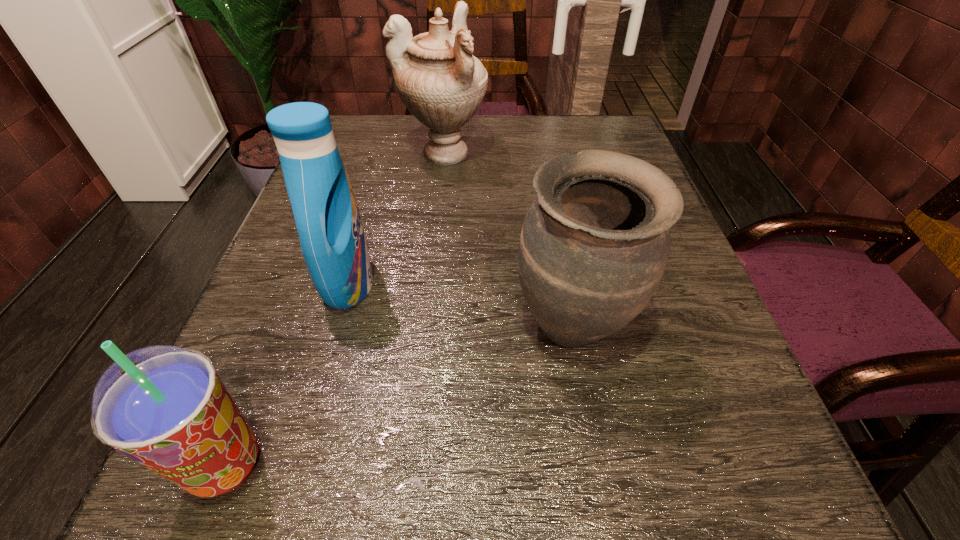
I want to click on unoccupied area between the farthest object and the shorter urn, so (508, 240).

Locate an element on the screen. free space between the nearest object and the detergent is located at coordinates [x=287, y=374].

Find the location of a particular element. vacant region between the nearest object and the shorter urn is located at coordinates click(x=399, y=396).

Identify the location of object that stands as the closest to the rightmost object. Image resolution: width=960 pixels, height=540 pixels. (333, 243).

Select which object is the second closest to the rightmost object. Please provide its 2D coordinates. Your answer should be formatted as a tuple, i.e. [(x, y)], where the tuple contains the x and y coordinates of a point satisfying the conditions above.

[(165, 407)]

You are a GUI agent. You are given a task and a screenshot of the screen. Output one action in this format:
    pyautogui.click(x=<x>, y=<y>)
    Task: Click on the vacant space that satisfies the following two spatial constraints: 1. on the front-facing side of the detergent; 2. on the back side of the rightmost object
    
    Given the screenshot: What is the action you would take?
    pyautogui.click(x=336, y=327)

Find the location of a particular element. The height and width of the screenshot is (540, 960). vacant space that satisfies the following two spatial constraints: 1. on the front side of the farthest object; 2. on the front-facing side of the detergent is located at coordinates pos(430,284).

In order to click on free location that satisfies the following two spatial constraints: 1. on the front-facing side of the detergent; 2. on the right side of the right urn in this screenshot , I will do coord(336,327).

What are the coordinates of `free space that satisfies the following two spatial constraints: 1. on the front-facing side of the right urn; 2. on the right side of the detergent` in the screenshot? It's located at (336, 327).